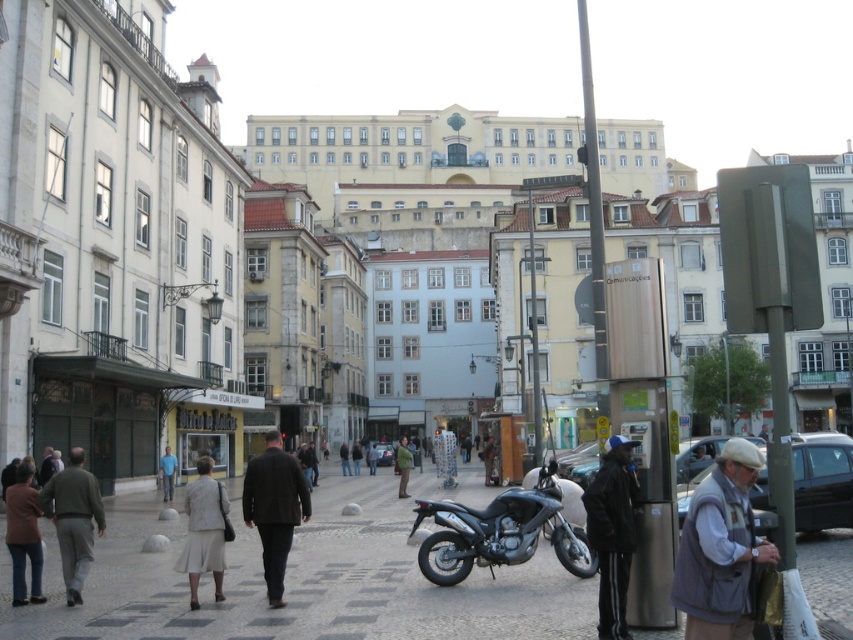
You are a photographer standing on the cobblestone street in the scene. You notice the brown wool coat at lower left and the light beige fabric skirt at lower left. Which of these two items is taller?

The brown wool coat at lower left is taller than the light beige fabric skirt at lower left.

You are a photographer standing on the street and want to take a photo of the light beige fabric skirt at lower left without the brown wool coat at lower left blocking it. What should you do?

Move to a position where the light beige fabric skirt at lower left is no longer behind the brown wool coat at lower left, allowing you to capture it without obstruction.